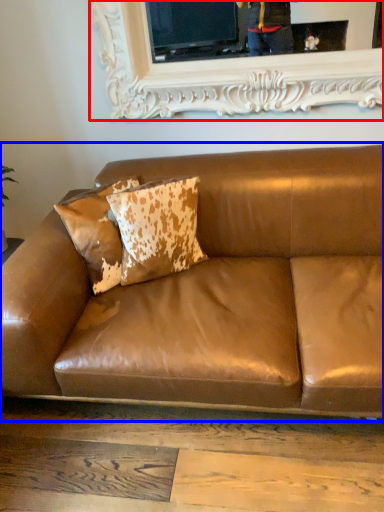
Question: Among these objects, which one is nearest to the camera, picture frame (highlighted by a red box) or studio couch (highlighted by a blue box)?

Choices:
 (A) picture frame
 (B) studio couch

Answer: (B)